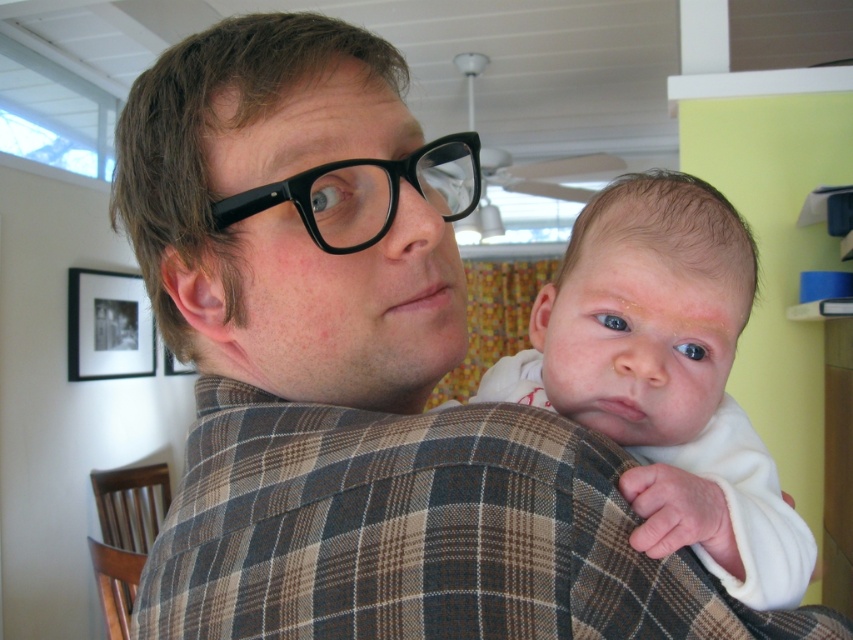
How much distance is there between white soft baby at center and black plastic glasses at center?

white soft baby at center is 6.82 inches away from black plastic glasses at center.

Which of these two, white soft baby at center or black plastic glasses at center, stands shorter?

With less height is black plastic glasses at center.

Is point (721, 392) positioned after point (367, 240)?

Yes, it is behind point (367, 240).

I want to click on white soft baby at center, so click(x=665, y=378).